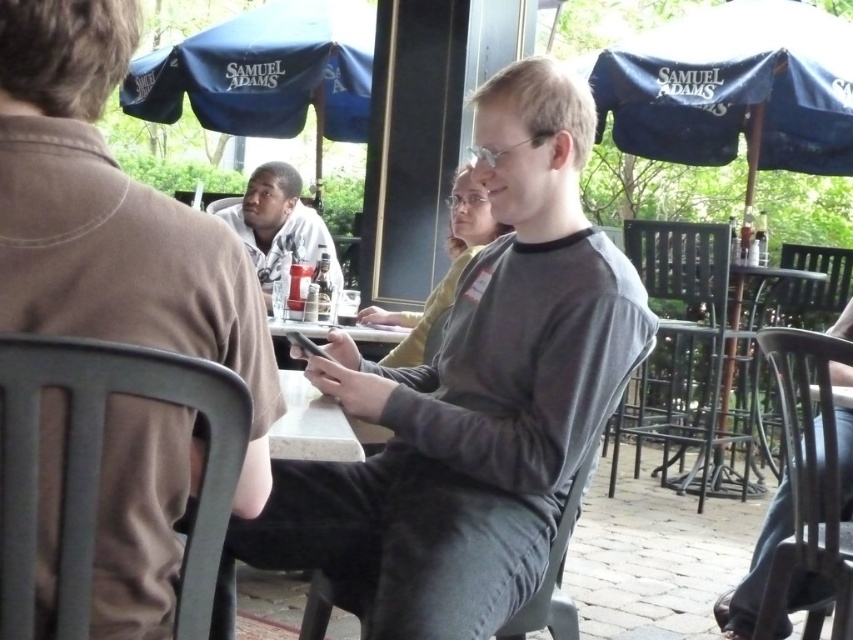
What do you see at coordinates (721, 104) in the screenshot?
I see `blue fabric umbrella at upper right` at bounding box center [721, 104].

Is blue fabric umbrella at upper right shorter than jeans at lower right?

In fact, blue fabric umbrella at upper right may be taller than jeans at lower right.

Is point (808, 157) positioned after point (778, 520)?

Yes, point (808, 157) is behind point (778, 520).

Where is `blue fabric umbrella at upper right`? Image resolution: width=853 pixels, height=640 pixels. blue fabric umbrella at upper right is located at coordinates (721, 104).

Does white marble table at center have a smaller size compared to smooth plastic table at center?

No.

Is the position of white marble table at center more distant than that of smooth plastic table at center?

Yes, it is.

Between point (386, 429) and point (386, 336), which one is positioned in front?

Point (386, 429) is in front.

Image resolution: width=853 pixels, height=640 pixels. What are the coordinates of `white marble table at center` in the screenshot? It's located at (375, 339).

Is light gray shirt at center above jeans at lower right?

Yes, light gray shirt at center is above jeans at lower right.

Is light gray shirt at center thinner than jeans at lower right?

In fact, light gray shirt at center might be wider than jeans at lower right.

The height and width of the screenshot is (640, 853). What are the coordinates of `light gray shirt at center` in the screenshot? It's located at (277, 225).

I want to click on light gray shirt at center, so click(277, 225).